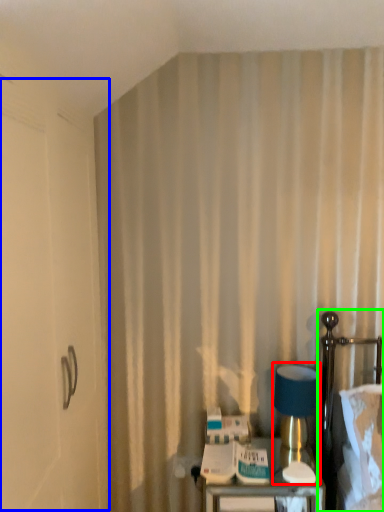
Question: Estimate the real-world distances between objects in this image. Which object is closer to table lamp (highlighted by a red box), screen door (highlighted by a blue box) or bed (highlighted by a green box)?

Choices:
 (A) screen door
 (B) bed

Answer: (B)